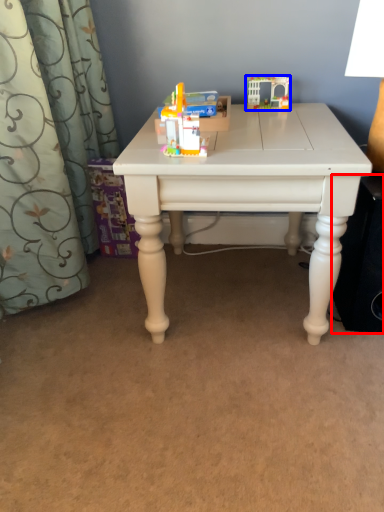
Question: Which of the following is the farthest to the observer, speaker (highlighted by a red box) or toy (highlighted by a blue box)?

Choices:
 (A) speaker
 (B) toy

Answer: (B)